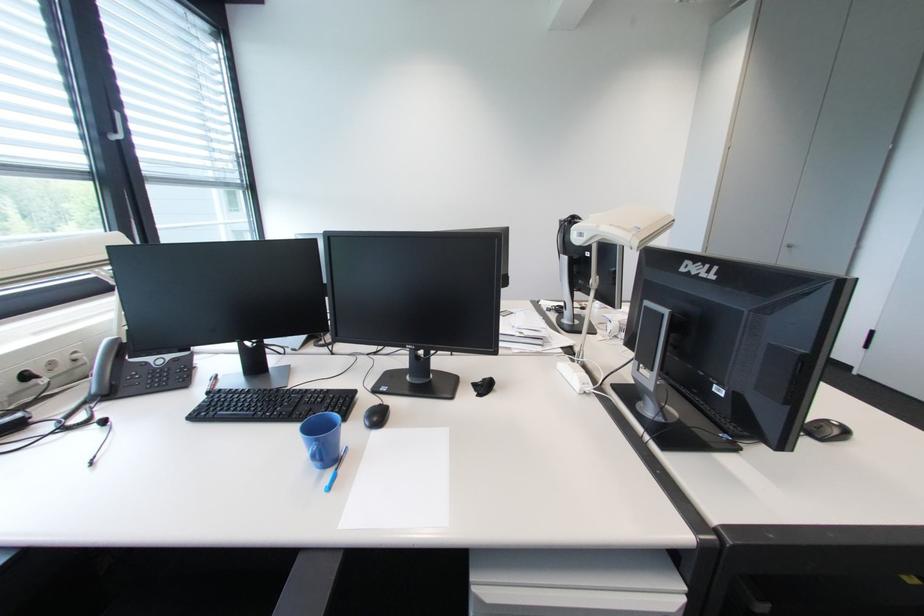
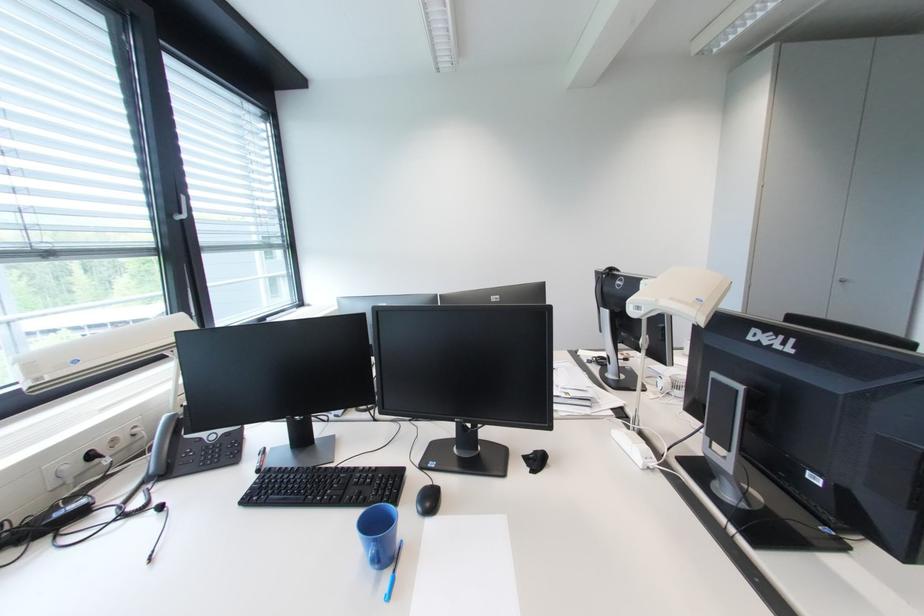
The point at (x=320, y=446) is marked in the first image. Where is the corresponding point in the second image?

(379, 546)